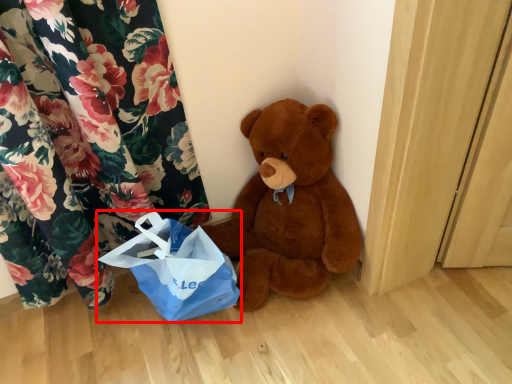
Question: From the image's perspective, what is the correct spatial relationship of grocery bag (annotated by the red box) in relation to teddy bear?

Choices:
 (A) above
 (B) below

Answer: (B)